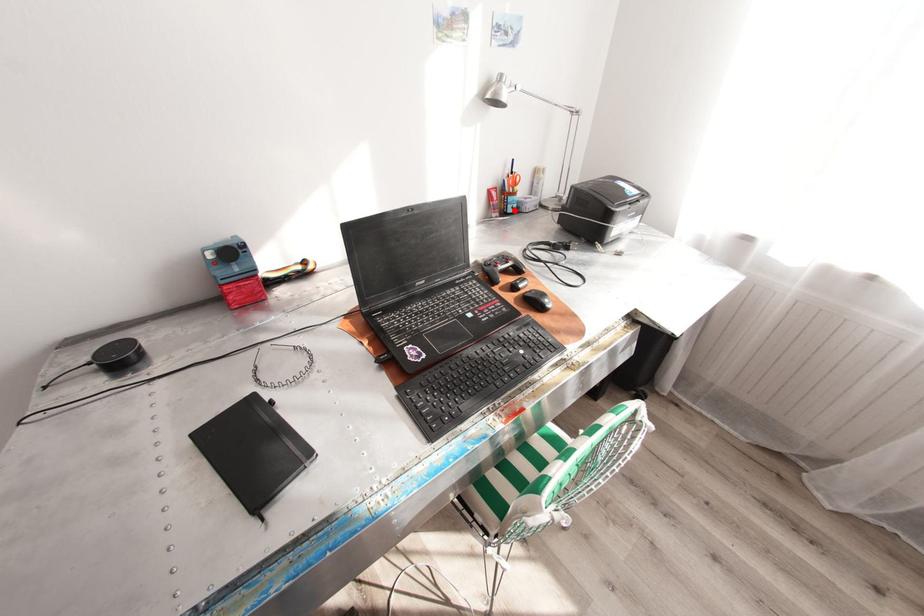
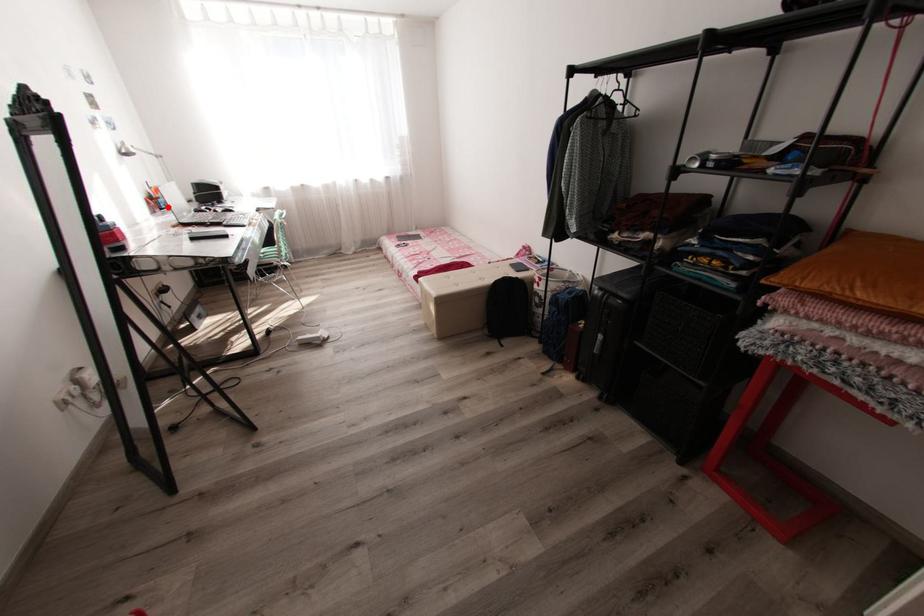
I am providing you with two images of the same scene from different viewpoints. A red point is marked on the first image and another point is marked on the second image. Does the point marked in image1 correspond to the same location as the one in image2?

Yes